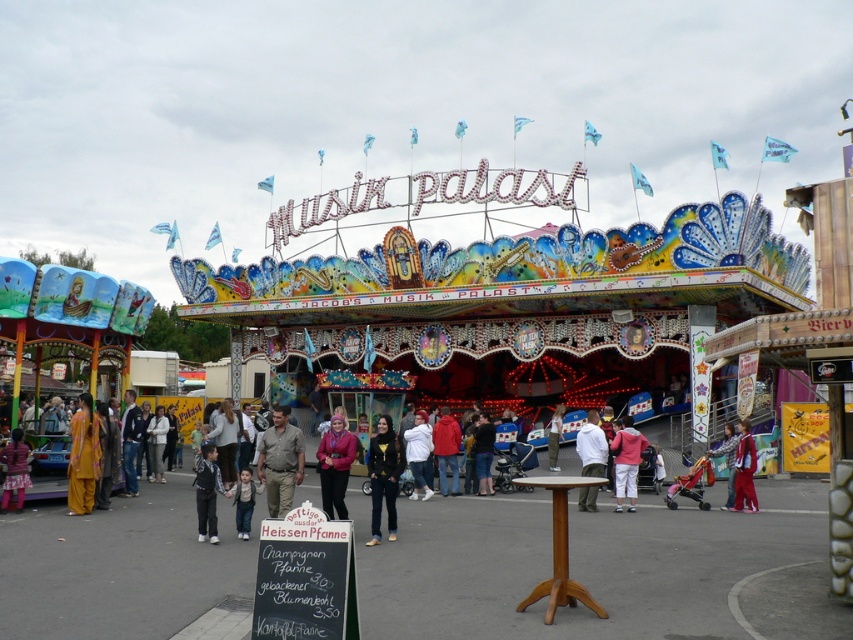
You are standing at the fairground and looking at the Musik Palast carousel. There are two points marked on the carousel structure. The first point is at coordinates point [624,417] and the second is at point [16,467]. Which point appears closer to you?

Point [624,417] is further to the camera than point [16,467], so the second point appears closer to you.

You are at the fairground and see two jackets hanging on a rack between the carousel and the snack stand. The jackets are the brown leather jacket at center and the black leather jacket at center. Which jacket is closer to the carousel?

The brown leather jacket at center is positioned on the left side of the black leather jacket at center. Since they are hanging between the carousel and the snack stand, the brown leather jacket at center is closer to the carousel.